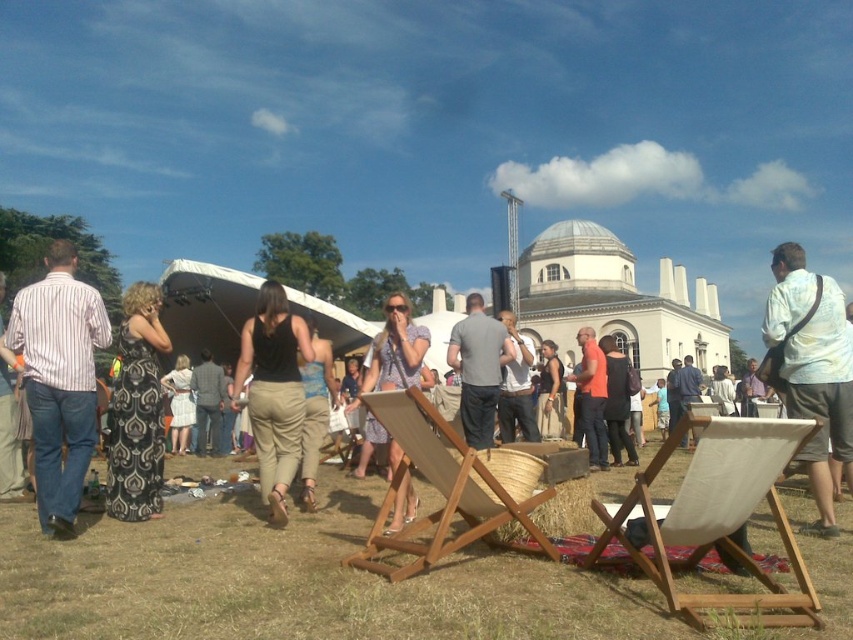
Which is below, orange cotton t-shirt at center or black tank top at center?

black tank top at center is lower down.

Can you confirm if orange cotton t-shirt at center is positioned to the right of black tank top at center?

Yes, orange cotton t-shirt at center is to the right of black tank top at center.

Does point (604, 444) come closer to viewer compared to point (558, 360)?

Yes, point (604, 444) is closer to viewer.

Find the location of a particular element. This screenshot has height=640, width=853. orange cotton t-shirt at center is located at coordinates (592, 397).

Between point (372, 352) and point (611, 429), which one is positioned in front?

Point (372, 352) is more forward.

Is matte purple dress at center shorter than black dress at center?

No, matte purple dress at center is not shorter than black dress at center.

Which is in front, point (404, 516) or point (606, 355)?

Point (404, 516) is in front.

Identify the location of matte purple dress at center. (396, 349).

Between green grass at lower center and matte purple dress at center, which one is positioned higher?

matte purple dress at center is above.

Who is shorter, green grass at lower center or matte purple dress at center?

green grass at lower center

The height and width of the screenshot is (640, 853). Describe the element at coordinates (294, 580) in the screenshot. I see `green grass at lower center` at that location.

Where is `green grass at lower center`? The image size is (853, 640). green grass at lower center is located at coordinates (294, 580).